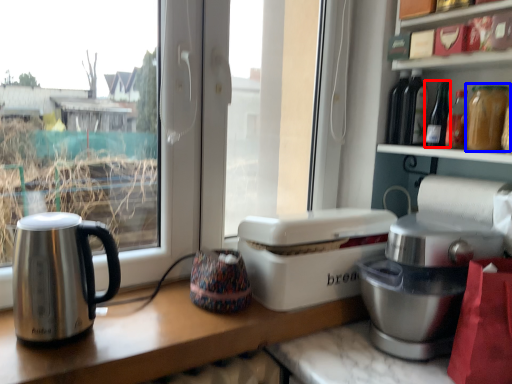
Question: Which point is further to the camera, bottle (highlighted by a red box) or bottle (highlighted by a blue box)?

Choices:
 (A) bottle
 (B) bottle

Answer: (A)